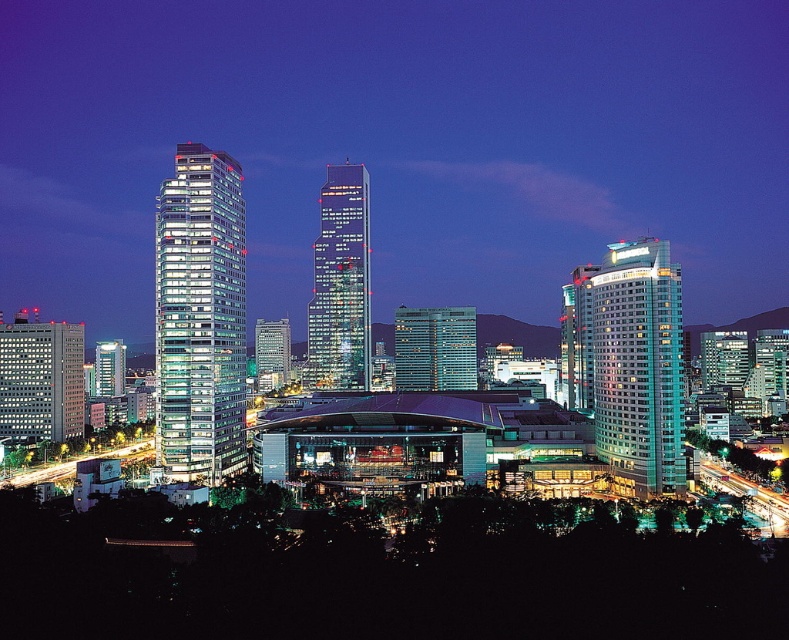
Who is more distant from viewer, (679, 428) or (36, 401)?

The point (36, 401) is more distant.

Identify the location of shiny glass skyscraper at right. (638, 364).

I want to click on glass skyscraper at center, so click(x=339, y=285).

Who is lower down, glass skyscraper at center or matte glass skyscraper at left?

matte glass skyscraper at left is below.

Is point (324, 376) behind point (19, 410)?

Yes, it is behind point (19, 410).

I want to click on glass skyscraper at center, so click(339, 285).

In the scene shown: Can you confirm if glassy modern skyscraper at left is positioned above glass skyscraper at center?

Incorrect, glassy modern skyscraper at left is not positioned above glass skyscraper at center.

This screenshot has height=640, width=789. What do you see at coordinates (200, 317) in the screenshot?
I see `glassy modern skyscraper at left` at bounding box center [200, 317].

Identify the location of glassy modern skyscraper at left. This screenshot has height=640, width=789. (200, 317).